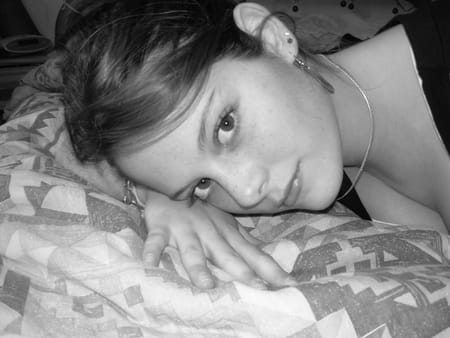
The width and height of the screenshot is (450, 338). What are the coordinates of `blanket` in the screenshot? It's located at (105, 260).